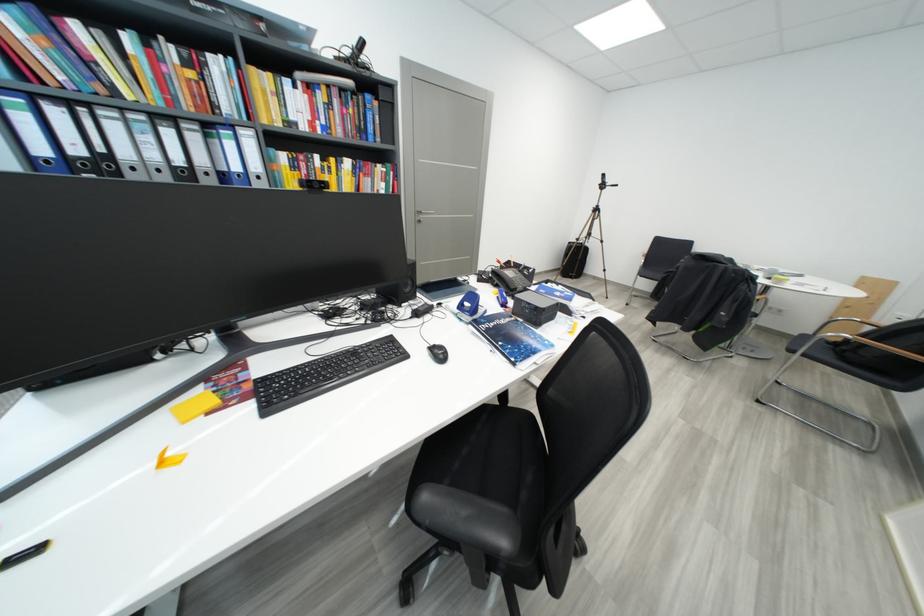
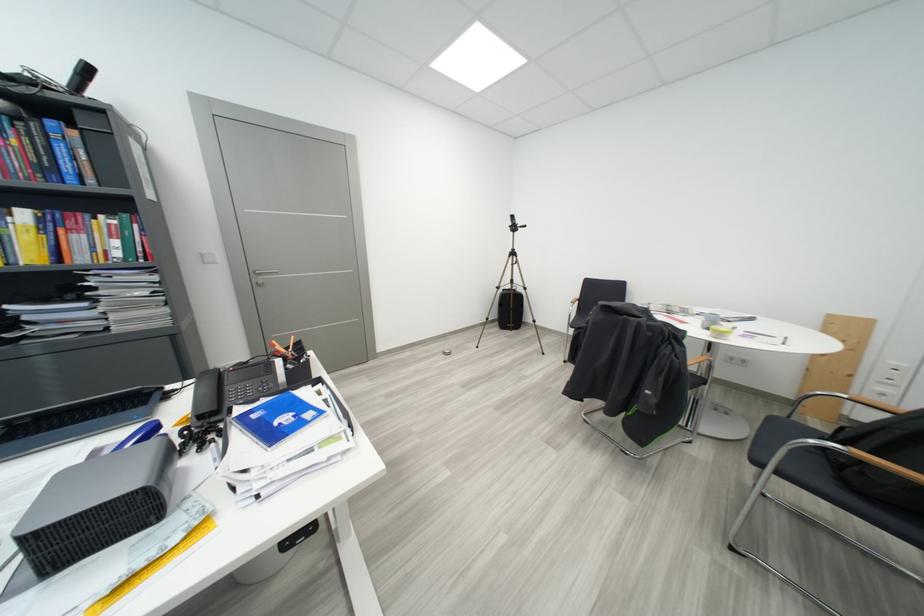
Find the pixel in the second image that matches (x=853, y=362) in the first image.

(856, 487)